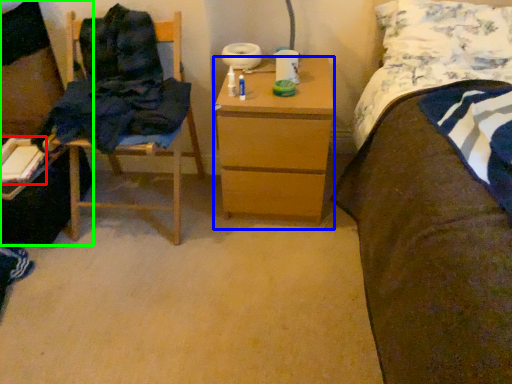
Question: Estimate the real-world distances between objects in this image. Which object is closer to book (highlighted by a red box), nightstand (highlighted by a blue box) or desk (highlighted by a green box)?

Choices:
 (A) nightstand
 (B) desk

Answer: (B)